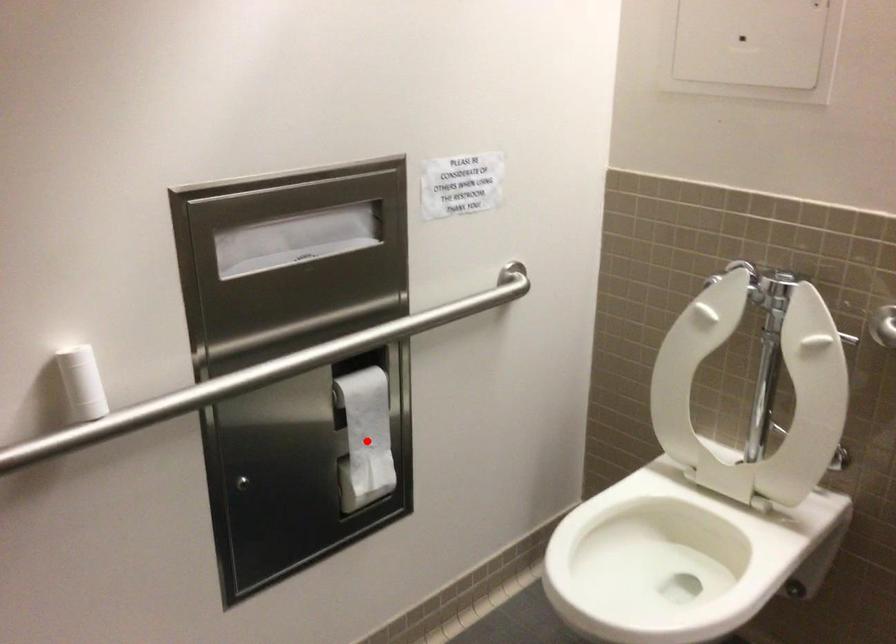
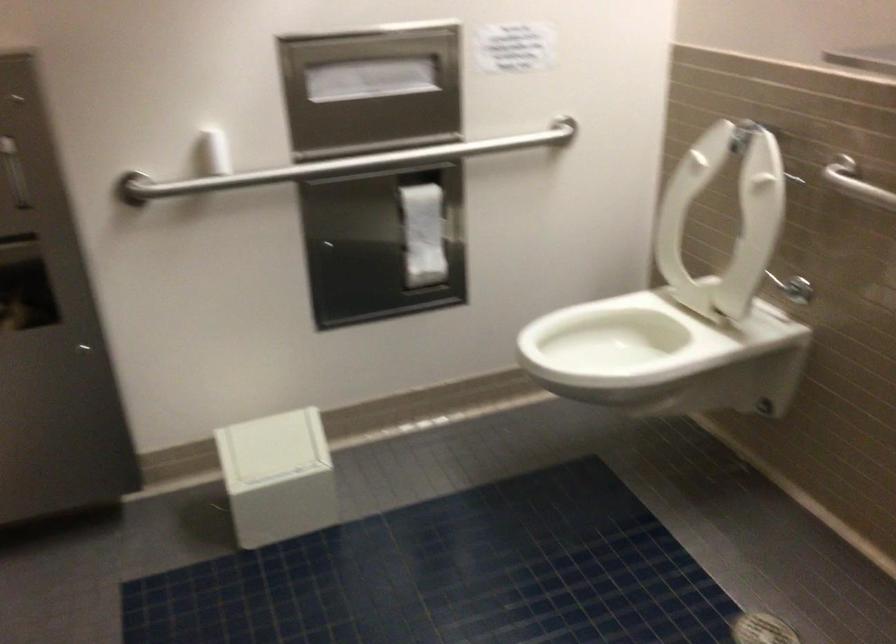
Where in the second image is the point corresponding to the highlighted location from the first image?

(423, 234)